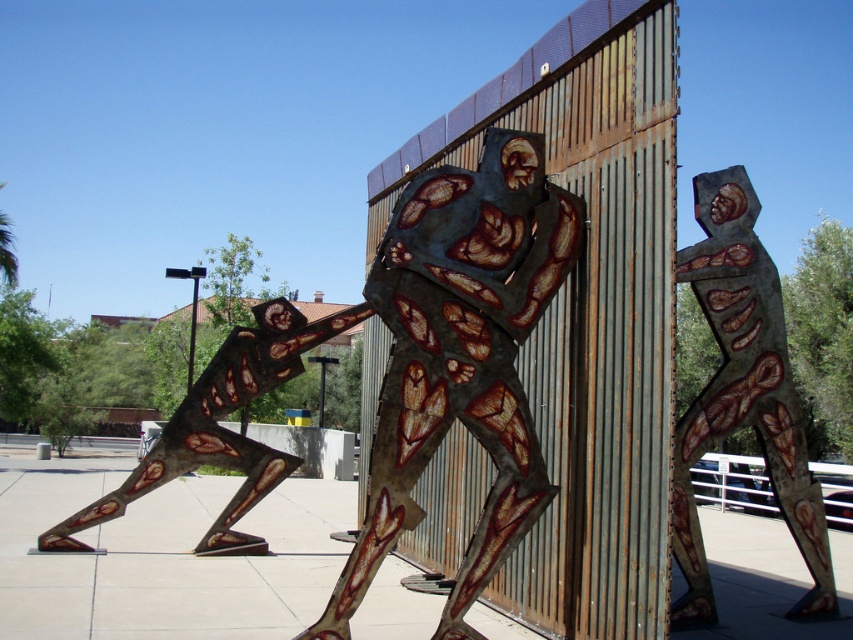
Is rusty metal figure at center closer to the viewer compared to rusty metal figure at upper right?

Yes, it is in front of rusty metal figure at upper right.

Is point (519, 477) less distant than point (692, 438)?

That is True.

At what (x,y) coordinates should I click in order to perform the action: click on rusty metal figure at center. Please return your answer as a coordinate pair (x, y). This screenshot has height=640, width=853. Looking at the image, I should click on (460, 355).